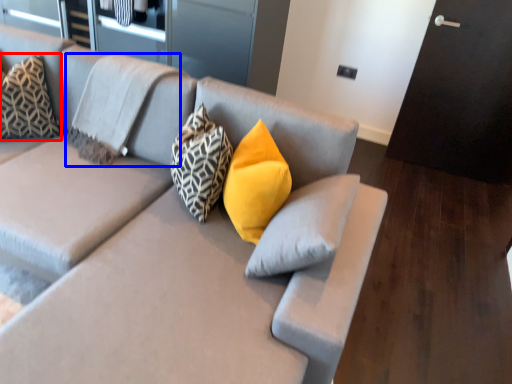
Question: Which object is further to the camera taking this photo, pillow (highlighted by a red box) or pillow (highlighted by a blue box)?

Choices:
 (A) pillow
 (B) pillow

Answer: (A)